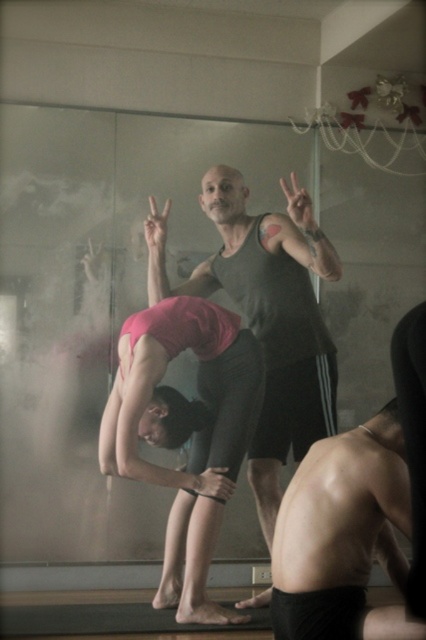
Question: Which object appears closest to the camera in this image?

Choices:
 (A) pink matte yoga pants at center
 (B) matte black tank top at center

Answer: (B)

Question: Does matte black tank top at center come in front of pink matte yoga pants at center?

Choices:
 (A) yes
 (B) no

Answer: (A)

Question: Which of the following is the closest to the observer?

Choices:
 (A) (173, 588)
 (B) (268, 365)

Answer: (B)

Question: Which of the following is the closest to the observer?

Choices:
 (A) pink matte yoga pants at center
 (B) matte black tank top at center

Answer: (B)

Question: Is matte black tank top at center smaller than pink matte yoga pants at center?

Choices:
 (A) yes
 (B) no

Answer: (B)

Question: Is matte black tank top at center further to the viewer compared to pink matte yoga pants at center?

Choices:
 (A) no
 (B) yes

Answer: (A)